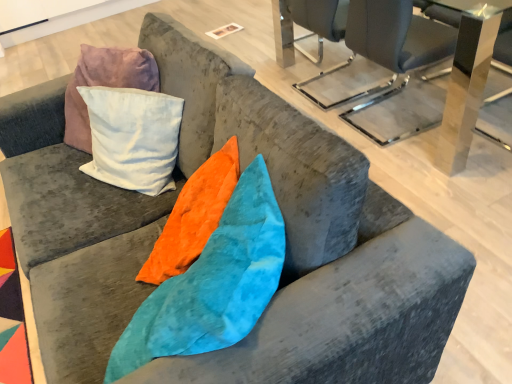
Question: From a real-world perspective, is transparent acrylic table at upper center, acting as the first table starting from the front, positioned under metallic gray chair at upper right based on gravity?

Choices:
 (A) no
 (B) yes

Answer: (A)

Question: Is transparent acrylic table at upper center, which is counted as the 2th table, starting from the back, wider than metallic gray chair at upper right?

Choices:
 (A) no
 (B) yes

Answer: (B)

Question: Is transparent acrylic table at upper center, which is counted as the 2th table, starting from the back, taller than metallic gray chair at upper right?

Choices:
 (A) yes
 (B) no

Answer: (A)

Question: Is the position of transparent acrylic table at upper center, acting as the first table starting from the front, less distant than that of metallic gray chair at upper right?

Choices:
 (A) yes
 (B) no

Answer: (A)

Question: Can you confirm if transparent acrylic table at upper center, acting as the first table starting from the front, is positioned to the right of metallic gray chair at upper right?

Choices:
 (A) no
 (B) yes

Answer: (B)

Question: Is metallic gray chair at upper right wider or thinner than transparent acrylic table at upper center, acting as the first table starting from the front?

Choices:
 (A) wide
 (B) thin

Answer: (B)

Question: Based on their positions, is metallic gray chair at upper right located to the left or right of transparent acrylic table at upper center, acting as the first table starting from the front?

Choices:
 (A) right
 (B) left

Answer: (B)

Question: Relative to transparent acrylic table at upper center, which is counted as the 2th table, starting from the back, is metallic gray chair at upper right in front or behind?

Choices:
 (A) front
 (B) behind

Answer: (B)

Question: Is point (353, 54) positioned closer to the camera than point (450, 117)?

Choices:
 (A) closer
 (B) farther

Answer: (B)

Question: In terms of size, does metallic gray chair at upper right appear bigger or smaller than metallic glass table at upper right, the first table in the back-to-front sequence?

Choices:
 (A) small
 (B) big

Answer: (B)

Question: Is metallic gray chair at upper right inside or outside of metallic glass table at upper right, placed as the 2th table when sorted from front to back?

Choices:
 (A) outside
 (B) inside

Answer: (A)

Question: From a real-world perspective, is metallic gray chair at upper right positioned above or below metallic glass table at upper right, the first table in the back-to-front sequence?

Choices:
 (A) above
 (B) below

Answer: (A)

Question: Relative to metallic glass table at upper right, placed as the 2th table when sorted from front to back, is metallic gray chair at upper right in front or behind?

Choices:
 (A) front
 (B) behind

Answer: (B)

Question: Considering the positions of transparent acrylic table at upper center, acting as the first table starting from the front, and metallic gray chair at upper right in the image, is transparent acrylic table at upper center, acting as the first table starting from the front, taller or shorter than metallic gray chair at upper right?

Choices:
 (A) tall
 (B) short

Answer: (A)

Question: Would you say transparent acrylic table at upper center, which is counted as the 2th table, starting from the back, is inside or outside metallic gray chair at upper right?

Choices:
 (A) outside
 (B) inside

Answer: (A)